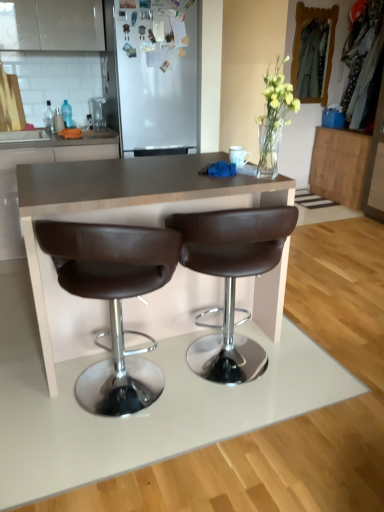
Question: Is wooden cabinet at right, placed as the 2th cabinetry when sorted from left to right, in front of or behind white matte refrigerator at upper center in the image?

Choices:
 (A) front
 (B) behind

Answer: (B)

Question: Visually, is wooden cabinet at right, placed as the 2th cabinetry when sorted from left to right, positioned to the left or to the right of white matte refrigerator at upper center?

Choices:
 (A) right
 (B) left

Answer: (A)

Question: Estimate the real-world distances between objects in this image. Which object is farther from the brown leather cabinet at center, the 2th cabinetry in the right-to-left sequence?

Choices:
 (A) matte white drawer at left
 (B) white matte refrigerator at upper center
 (C) brown leather stool at center, positioned as the first chair in left-to-right order
 (D) wooden cabinet at right, placed as the 2th cabinetry when sorted from left to right
 (E) brown leather stool at center, arranged as the 1th chair when viewed from the right

Answer: (D)

Question: Based on their relative distances, which object is farther from the brown leather stool at center, the 2th chair positioned from the left?

Choices:
 (A) white matte refrigerator at upper center
 (B) brown leather cabinet at center, acting as the 1th cabinetry starting from the left
 (C) brown leather stool at center, acting as the second chair starting from the right
 (D) wooden cabinet at right, which ranks as the 2th cabinetry in front-to-back order
 (E) matte white drawer at left

Answer: (D)